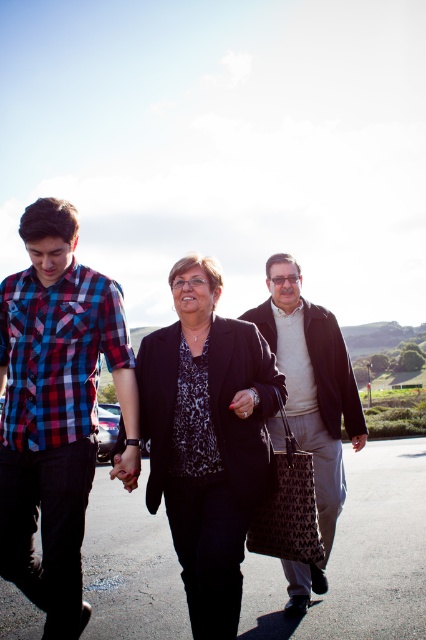
Does black fabric parking lot at center have a lesser height compared to black printed fabric bag at center?

Incorrect, black fabric parking lot at center's height does not fall short of black printed fabric bag at center's.

Does point (333, 624) lie in front of point (296, 490)?

No, it is behind (296, 490).

Does point (382, 497) come closer to viewer compared to point (293, 540)?

That is False.

This screenshot has width=426, height=640. Find the location of `black fabric parking lot at center`. black fabric parking lot at center is located at coordinates (357, 557).

The image size is (426, 640). What do you see at coordinates (207, 438) in the screenshot?
I see `matte black blazer at center` at bounding box center [207, 438].

Is matte black blazer at center further to camera compared to black printed fabric bag at center?

No, it is in front of black printed fabric bag at center.

Which is behind, point (173, 324) or point (273, 464)?

Positioned behind is point (173, 324).

You are a GUI agent. You are given a task and a screenshot of the screen. Output one action in this format:
    pyautogui.click(x=<x>, y=<y>)
    Task: Click on the matte black blazer at center
    
    Given the screenshot: What is the action you would take?
    pyautogui.click(x=207, y=438)

Can you confirm if black fabric parking lot at center is positioned to the right of matte black blazer at center?

Correct, you'll find black fabric parking lot at center to the right of matte black blazer at center.

Does black fabric parking lot at center appear over matte black blazer at center?

No.

Identify the location of black fabric parking lot at center. (357, 557).